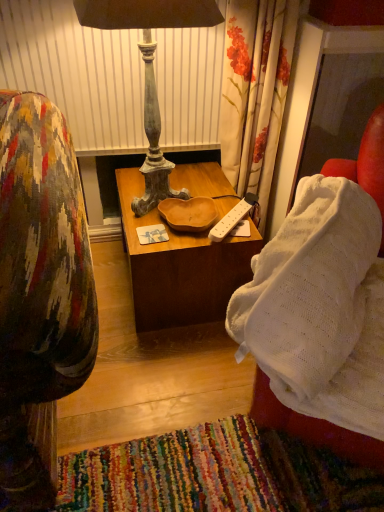
What is the approximate width of white knitted blanket at right?

It is 62.03 centimeters.

Find the location of a particular element. Image resolution: width=384 pixels, height=512 pixels. distressed wood lamp at center is located at coordinates (150, 70).

Considering the sizes of white knitted blanket at right and wooden table at center in the image, is white knitted blanket at right taller or shorter than wooden table at center?

Clearly, white knitted blanket at right is taller compared to wooden table at center.

Which is more to the right, white knitted blanket at right or wooden table at center?

white knitted blanket at right is more to the right.

What's the angular difference between white knitted blanket at right and wooden table at center's facing directions?

The angle between the facing direction of white knitted blanket at right and the facing direction of wooden table at center is 38.5 degrees.

Considering their positions, is white knitted blanket at right located in front of or behind wooden table at center?

In the image, white knitted blanket at right appears in front of wooden table at center.

Could you tell me if white plastic power strip at center is facing white knitted blanket at right?

No, white plastic power strip at center does not turn towards white knitted blanket at right.

Looking at this image, how many degrees apart are the facing directions of white plastic power strip at center and white knitted blanket at right?

The angle between the facing direction of white plastic power strip at center and the facing direction of white knitted blanket at right is 3.13 degrees.

From a real-world perspective, between white plastic power strip at center and white knitted blanket at right, who is vertically higher?

white knitted blanket at right, from a real-world perspective.

Is white plastic power strip at center wider than white knitted blanket at right?

No.

From the image's perspective, which one is positioned higher, white knitted blanket at right or distressed wood lamp at center?

From the image's view, distressed wood lamp at center is above.

Based on their sizes in the image, would you say white knitted blanket at right is bigger or smaller than distressed wood lamp at center?

Clearly, white knitted blanket at right is larger in size than distressed wood lamp at center.

Consider the image. Considering the sizes of objects white knitted blanket at right and distressed wood lamp at center in the image provided, who is taller, white knitted blanket at right or distressed wood lamp at center?

Standing taller between the two is distressed wood lamp at center.

Which of these two, white plastic power strip at center or wooden table at center, stands shorter?

white plastic power strip at center.

Does point (257, 200) lie behind point (241, 273)?

Yes.

Considering the sizes of objects white plastic power strip at center and wooden table at center in the image provided, who is thinner, white plastic power strip at center or wooden table at center?

With smaller width is white plastic power strip at center.

From their relative heights in the image, would you say wooden table at center is taller or shorter than distressed wood lamp at center?

In the image, wooden table at center appears to be shorter than distressed wood lamp at center.

Is wooden table at center far away from distressed wood lamp at center?

No, wooden table at center is in close proximity to distressed wood lamp at center.

Which point is more distant from viewer, (230, 207) or (139, 16)?

The point (230, 207) is farther from the camera.

Is wooden table at center positioned beyond the bounds of distressed wood lamp at center?

Yes, wooden table at center is outside of distressed wood lamp at center.

From the image's perspective, between wooden table at center and white plastic power strip at center, who is located below?

wooden table at center appears lower in the image.

Which is more to the left, wooden table at center or white plastic power strip at center?

wooden table at center.

Is wooden table at center bigger or smaller than white plastic power strip at center?

Considering their sizes, wooden table at center takes up more space than white plastic power strip at center.

Who is more distant, wooden table at center or white plastic power strip at center?

white plastic power strip at center is further from the camera.

Which is in front, distressed wood lamp at center or wooden table at center?

distressed wood lamp at center.

Is distressed wood lamp at center inside the boundaries of wooden table at center, or outside?

distressed wood lamp at center is not inside wooden table at center, it's outside.

Considering the sizes of objects distressed wood lamp at center and wooden table at center in the image provided, who is bigger, distressed wood lamp at center or wooden table at center?

wooden table at center is bigger.

From the image's perspective, is distressed wood lamp at center positioned above or below wooden table at center?

distressed wood lamp at center is above wooden table at center.

Locate an element on the screen. table directly beneath the white knitted blanket at right (from a real-world perspective) is located at coordinates (180, 267).

Where is `remote above the white knitted blanket at right (from the image's perspective)`? Image resolution: width=384 pixels, height=512 pixels. remote above the white knitted blanket at right (from the image's perspective) is located at coordinates coord(232,218).

Looking at the image, which one is located further to white knitted blanket at right, white plastic power strip at center or distressed wood lamp at center?

Based on the image, distressed wood lamp at center appears to be further to white knitted blanket at right.

Estimate the real-world distances between objects in this image. Which object is further from white knitted blanket at right, distressed wood lamp at center or white plastic power strip at center?

distressed wood lamp at center is further to white knitted blanket at right.

Looking at the image, which one is located further to distressed wood lamp at center, wooden table at center or white plastic power strip at center?

Among the two, white plastic power strip at center is located further to distressed wood lamp at center.

Which object lies nearer to the anchor point white plastic power strip at center, wooden table at center or distressed wood lamp at center?

wooden table at center is positioned closer to the anchor white plastic power strip at center.

Looking at the image, which one is located closer to white plastic power strip at center, wooden table at center or white knitted blanket at right?

wooden table at center is closer to white plastic power strip at center.

Based on their spatial positions, is distressed wood lamp at center or white plastic power strip at center further from wooden table at center?

distressed wood lamp at center is positioned further to the anchor wooden table at center.

Which object lies nearer to the anchor point white knitted blanket at right, wooden table at center or white plastic power strip at center?

Based on the image, white plastic power strip at center appears to be nearer to white knitted blanket at right.

Looking at the image, which one is located further to wooden table at center, white knitted blanket at right or distressed wood lamp at center?

white knitted blanket at right is further to wooden table at center.

Identify the location of table between white knitted blanket at right and white plastic power strip at center along the z-axis. This screenshot has height=512, width=384. (180, 267).

Image resolution: width=384 pixels, height=512 pixels. In order to click on table located between distressed wood lamp at center and white plastic power strip at center in the depth direction in this screenshot , I will do `click(180, 267)`.

You are a GUI agent. You are given a task and a screenshot of the screen. Output one action in this format:
    pyautogui.click(x=<x>, y=<y>)
    Task: Click on the lamp between white knitted blanket at right and white plastic power strip at center along the z-axis
    This screenshot has width=384, height=512.
    Given the screenshot: What is the action you would take?
    pyautogui.click(x=150, y=70)

Find the location of a particular element. The image size is (384, 512). lamp positioned between white knitted blanket at right and wooden table at center from near to far is located at coordinates (150, 70).